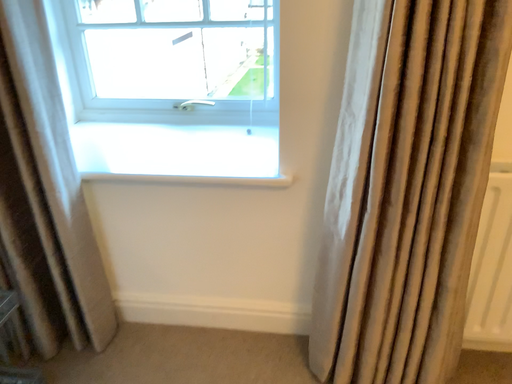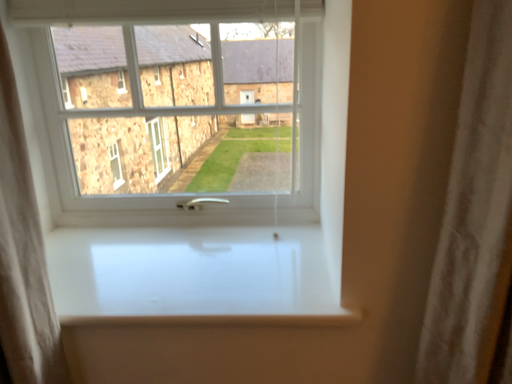
Question: How did the camera likely rotate when shooting the video?

Choices:
 (A) rotated upward
 (B) rotated downward

Answer: (A)